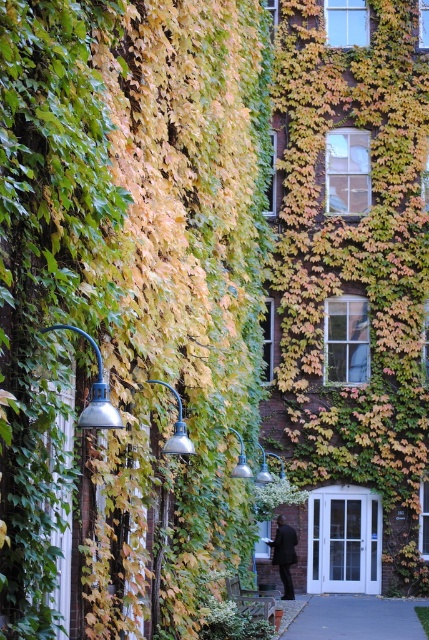
You are a maintenance worker who needs to replace the bulbs in the lamps. You have a ladder that can reach up to 20 feet. If you start at the metallic blue lamp at left, can you reach the matte silver lamp at center without moving the ladder?

The distance between the metallic blue lamp at left and the matte silver lamp at center is 19.92 feet. Since the ladder can reach up to 20 feet, you can just barely reach the matte silver lamp at center without moving the ladder.

Based on the photo, you are a gardener who needs to place a new decorative rock. The gray concrete pavement at lower center and the green leafy plant at center are both in your view. Which area has more space to accommodate a larger rock?

The gray concrete pavement at lower center has a larger size compared to the green leafy plant at center, so it has more space to accommodate a larger rock.